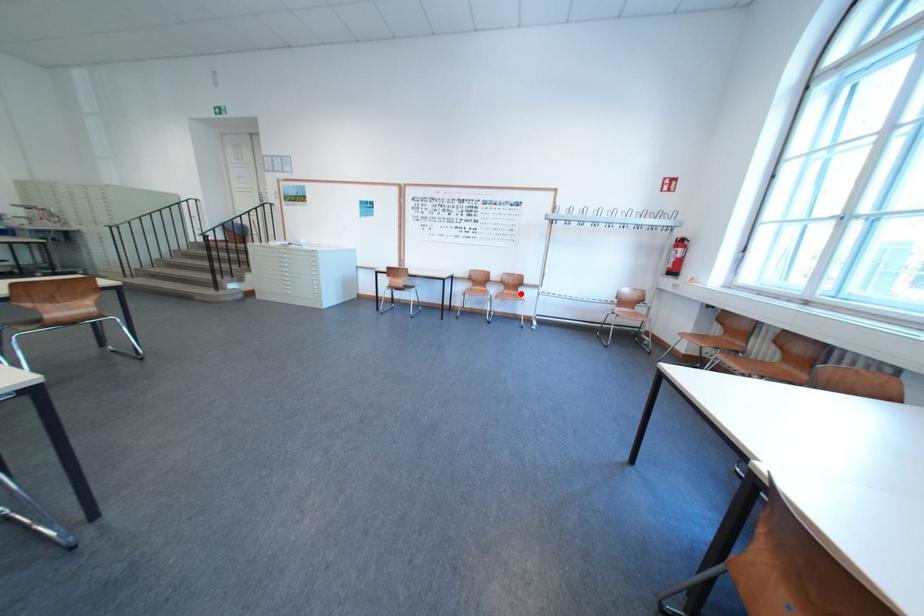
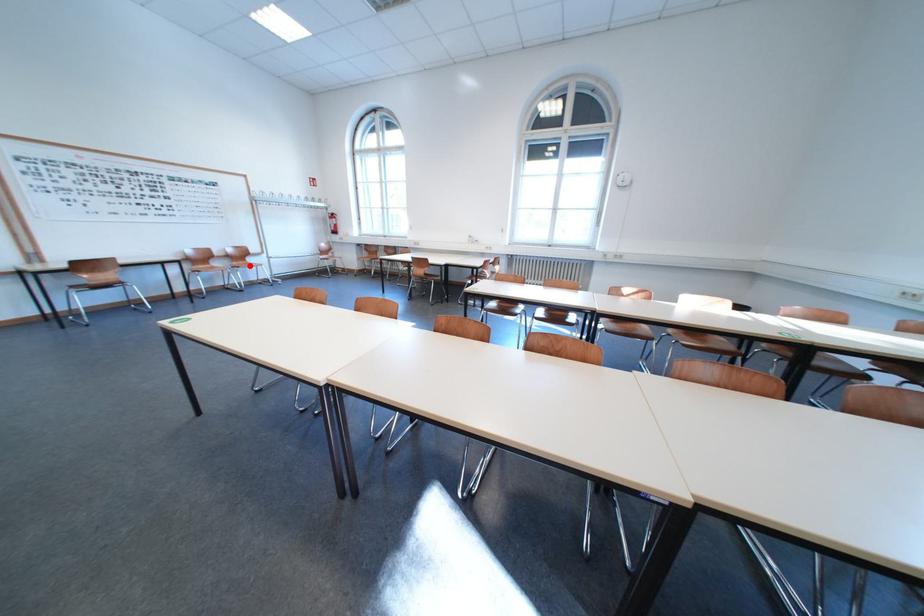
I am providing you with two images of the same scene from different viewpoints. A red point is marked on the first image and another point is marked on the second image. Are the points marked in image1 and image2 representing the same 3D position?

Yes